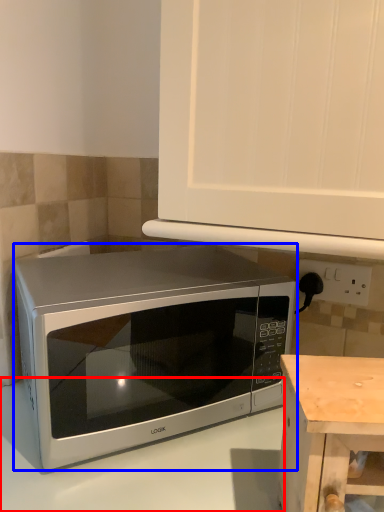
Question: Which object appears farthest to the camera in this image, counter top (highlighted by a red box) or microwave oven (highlighted by a blue box)?

Choices:
 (A) counter top
 (B) microwave oven

Answer: (B)